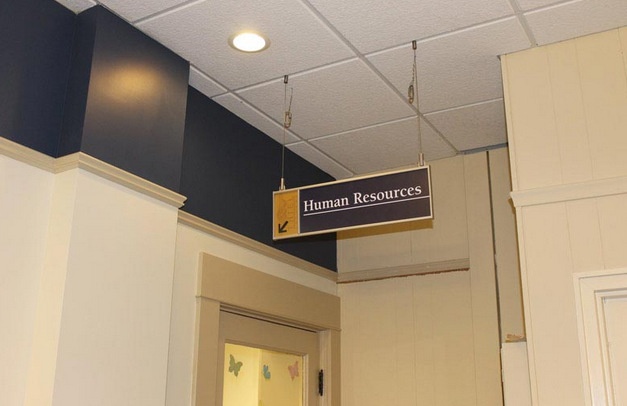
At what (x,y) coordinates should I click in order to perform the action: click on white wall. Please return your answer as a coordinate pair (x, y). The image size is (627, 406). Looking at the image, I should click on (23, 277), (117, 291), (184, 332).